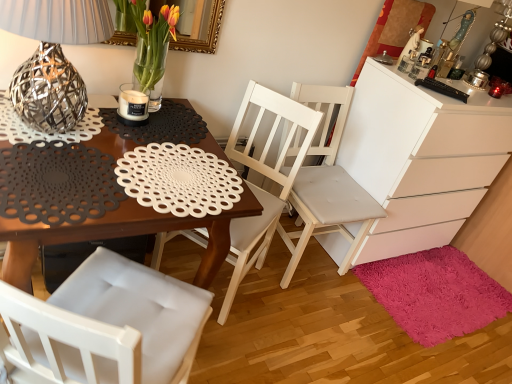
The image size is (512, 384). What are the coordinates of `free location in front of white matte candle at table` in the screenshot? It's located at pos(119,137).